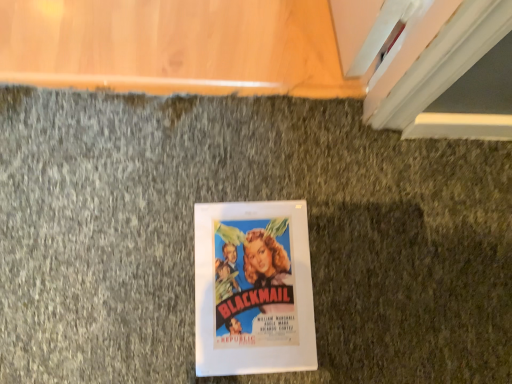
The image size is (512, 384). I want to click on free point behind matte paper poster at center, so click(278, 161).